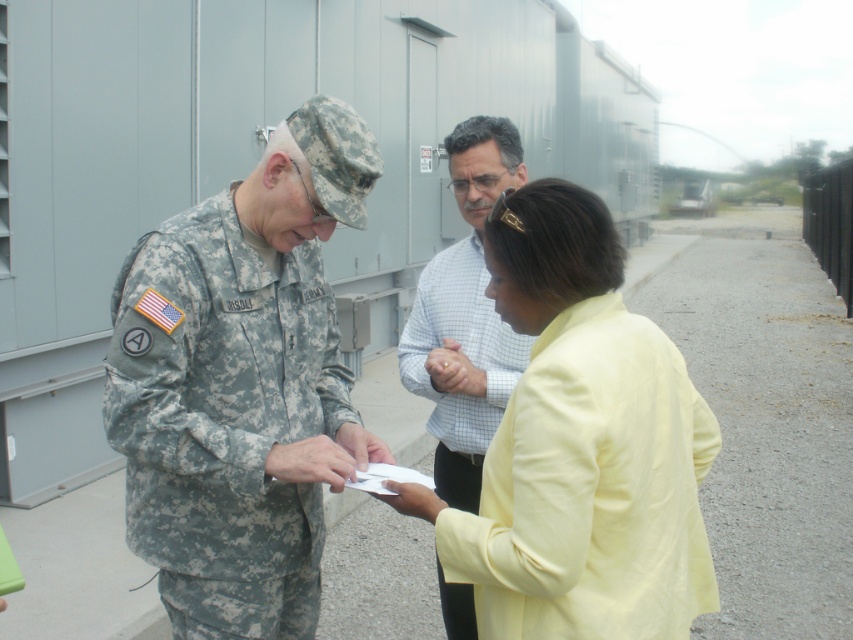
You are a photographer trying to capture a clear photo of both the yellow fabric jacket at center and the light blue checkered shirt at center. Since you want both subjects to be in focus, which one should you focus on first?

You should focus on the yellow fabric jacket at center first because it is in front of the light blue checkered shirt at center, so focusing on the closer subject will ensure both are in focus.